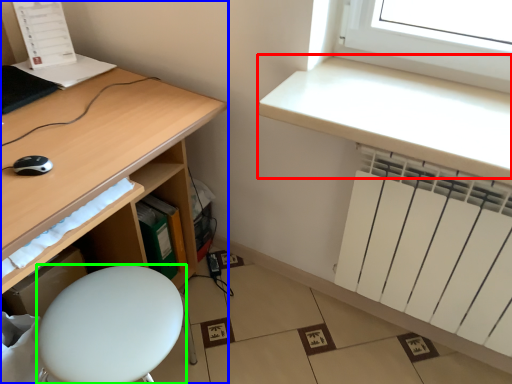
Question: Based on their relative distances, which object is farther from counter top (highlighted by a red box)? Choose from desk (highlighted by a blue box) and furniture (highlighted by a green box).

Choices:
 (A) desk
 (B) furniture

Answer: (B)